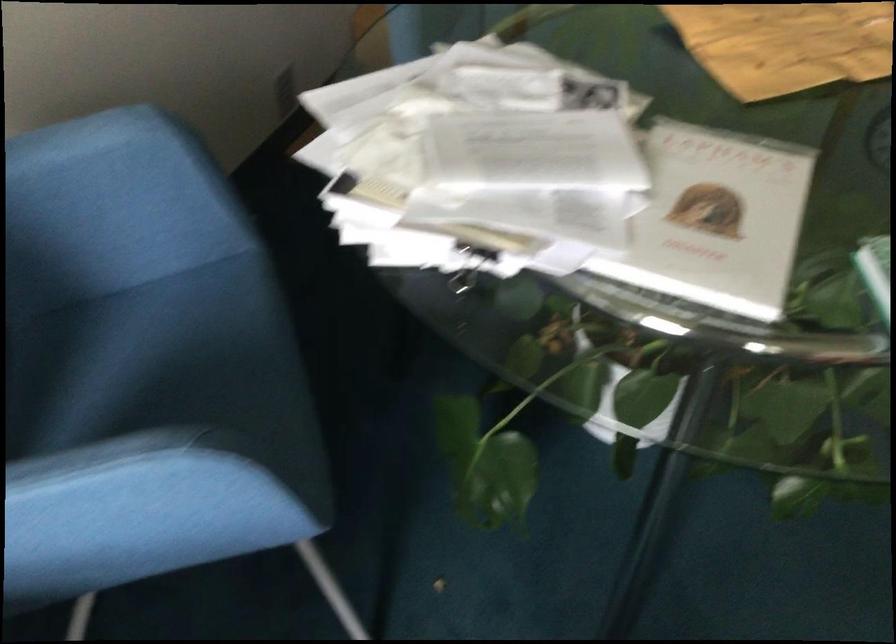
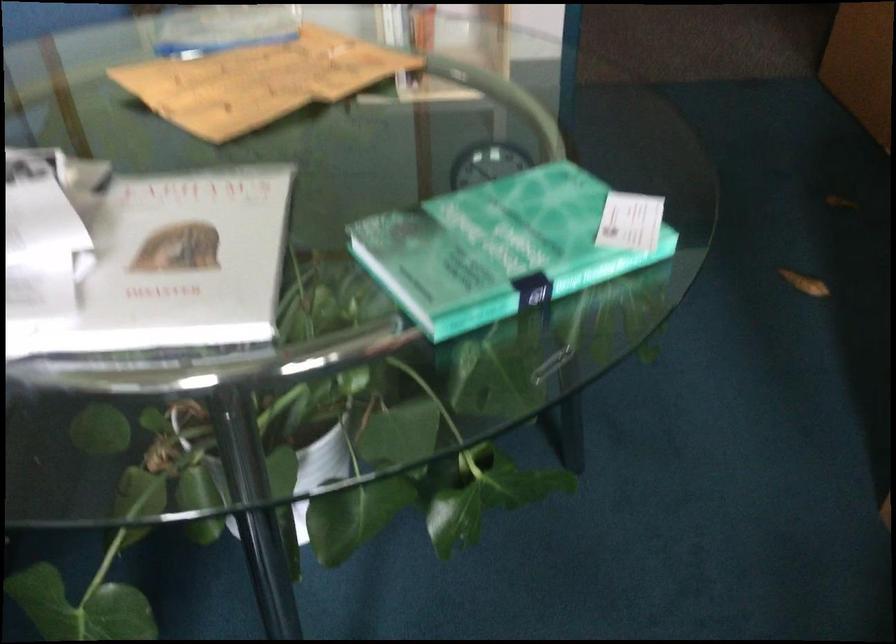
Question: I am providing you with two images of the same scene from different viewpoints. After the viewpoint changes to image2, which objects are now occluded?

Choices:
 (A) green cover book
 (B) blue spray bottle nozzle
 (C) white cover book
 (D) binder clip

Answer: (D)